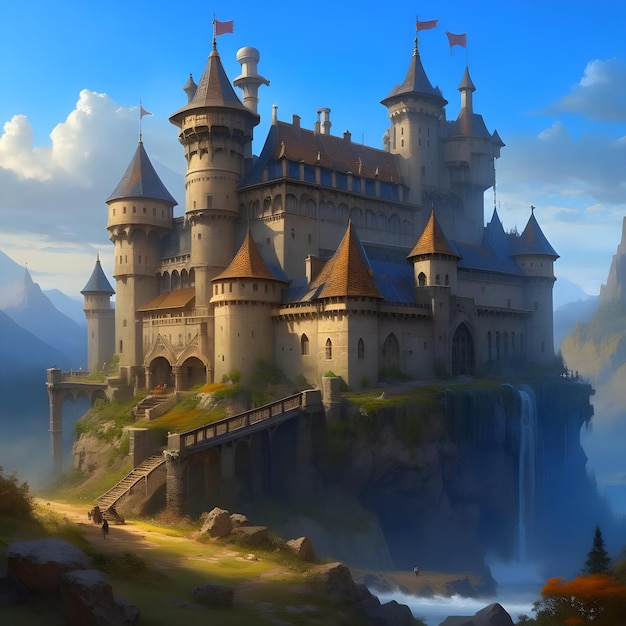
Find the location of a particular element. windows is located at coordinates (305, 342), (327, 347), (357, 347).